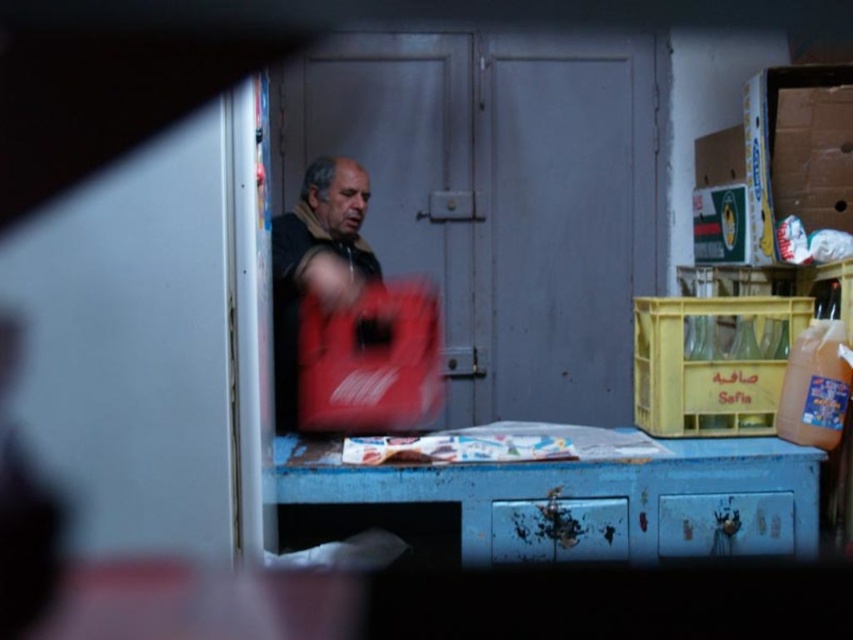
Question: Is blue painted wood table at lower center positioned in front of dark brown leather jacket at center?

Choices:
 (A) yes
 (B) no

Answer: (A)

Question: Does blue painted wood table at lower center have a larger size compared to dark brown leather jacket at center?

Choices:
 (A) no
 (B) yes

Answer: (A)

Question: Which of the following is the farthest from the observer?

Choices:
 (A) dark brown leather jacket at center
 (B) blue painted wood table at lower center

Answer: (A)

Question: Where is blue painted wood table at lower center located in relation to dark brown leather jacket at center in the image?

Choices:
 (A) below
 (B) above

Answer: (A)